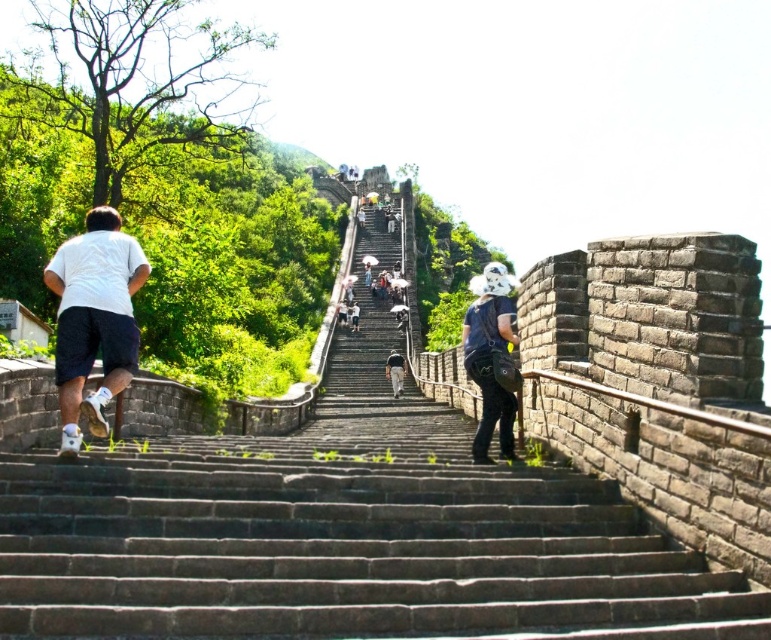
Question: Which object appears closest to the camera in this image?

Choices:
 (A) dark gray stone stairs at center
 (B) white matte shorts at left

Answer: (A)

Question: Considering the relative positions of dark gray stone stairs at center and dark blue denim overalls at center in the image provided, where is dark gray stone stairs at center located with respect to dark blue denim overalls at center?

Choices:
 (A) left
 (B) right

Answer: (A)

Question: Can you confirm if white matte shorts at left is wider than dark blue denim overalls at center?

Choices:
 (A) yes
 (B) no

Answer: (A)

Question: Is white matte shorts at left positioned at the back of dark blue denim overalls at center?

Choices:
 (A) yes
 (B) no

Answer: (B)

Question: Which is farther from the white matte shorts at left?

Choices:
 (A) dark blue denim overalls at center
 (B) dark gray stone stairs at center

Answer: (A)

Question: Which point is farther to the camera?

Choices:
 (A) dark blue denim overalls at center
 (B) white matte shorts at left

Answer: (A)